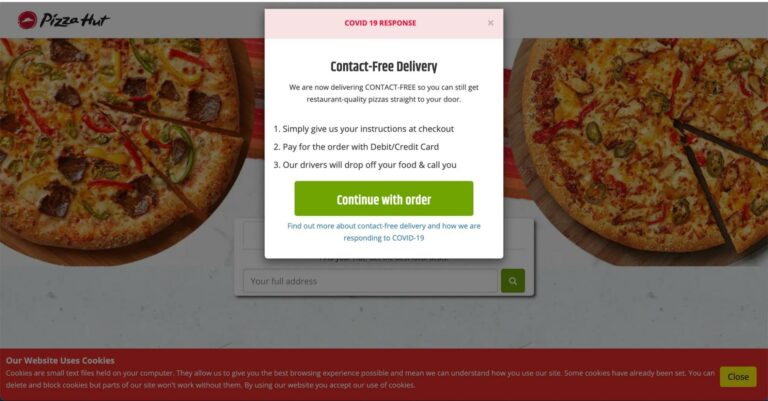
Locate an element on the screen. Image resolution: width=768 pixels, height=401 pixels. white table is located at coordinates (601, 315).